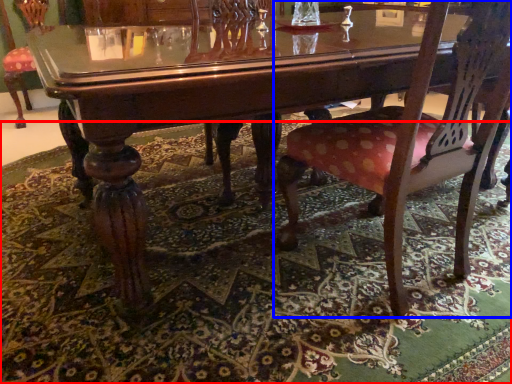
Question: Which point is closer to the camera, mat (highlighted by a red box) or chair (highlighted by a blue box)?

Choices:
 (A) mat
 (B) chair

Answer: (A)